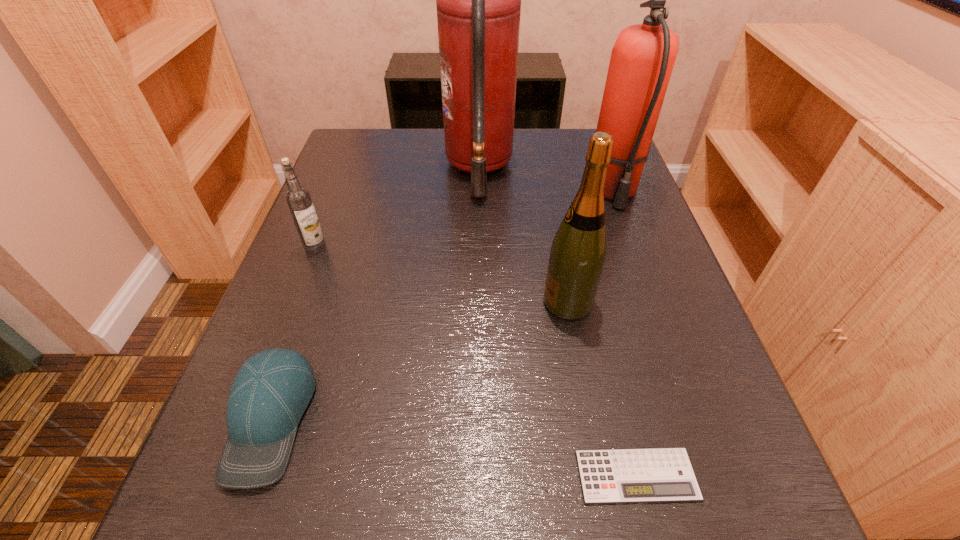
At what (x,y) coordinates should I click in order to perform the action: click on free space located 0.140m on the front-facing side of the fourth shortest object. Please return your answer as a coordinate pair (x, y). This screenshot has width=960, height=540. Looking at the image, I should click on (464, 302).

You are a GUI agent. You are given a task and a screenshot of the screen. Output one action in this format:
    pyautogui.click(x=<x>, y=<y>)
    Task: Click on the vacant space located 0.060m on the front-facing side of the fourth shortest object
    Image resolution: width=960 pixels, height=540 pixels.
    Given the screenshot: What is the action you would take?
    pyautogui.click(x=509, y=302)

Identify the location of vacant space located on the front-facing side of the fourth shortest object. (509, 302).

Find the location of a particular element. vacant space positioned on the label of the fourth nearest object is located at coordinates (250, 418).

Image resolution: width=960 pixels, height=540 pixels. In order to click on vacant point located 0.380m on the right of the fifth tallest object in this screenshot , I will do `click(577, 419)`.

Locate an element on the screen. Image resolution: width=960 pixels, height=540 pixels. vacant position located 0.230m on the left of the calculator is located at coordinates (400, 475).

Locate an element on the screen. Image resolution: width=960 pixels, height=540 pixels. baseball cap that is at the near edge is located at coordinates (271, 391).

In order to click on calculator located at the near edge in this screenshot , I will do `click(650, 475)`.

At what (x,y) coordinates should I click in order to perform the action: click on vodka located in the left edge section of the desktop. Please return your answer as a coordinate pair (x, y). This screenshot has width=960, height=540. Looking at the image, I should click on (298, 198).

I want to click on baseball cap that is at the left edge, so click(x=271, y=391).